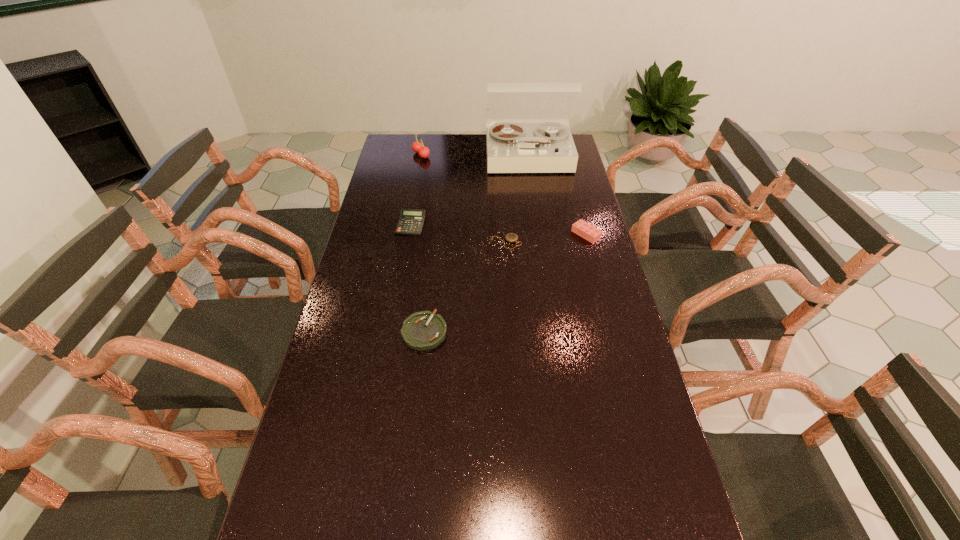
Locate an element on the screen. The height and width of the screenshot is (540, 960). record player is located at coordinates (511, 148).

The height and width of the screenshot is (540, 960). In order to click on cherry in this screenshot , I will do `click(417, 147)`.

Locate an element on the screen. the third tallest object is located at coordinates (592, 234).

The width and height of the screenshot is (960, 540). I want to click on the fourth tallest object, so click(x=411, y=221).

Identify the location of ashtray. (424, 330).

Locate an element on the screen. the nearest object is located at coordinates (424, 330).

Locate an element on the screen. This screenshot has height=540, width=960. pocket watch is located at coordinates (510, 237).

The image size is (960, 540). Identify the location of vacant position located 0.110m on the front of the tallest object. (533, 190).

This screenshot has width=960, height=540. What are the coordinates of `vacant space located on the front of the fifth shortest object` in the screenshot? It's located at (411, 211).

The width and height of the screenshot is (960, 540). What are the coordinates of `vacant space situated on the front of the Lego` in the screenshot? It's located at (611, 326).